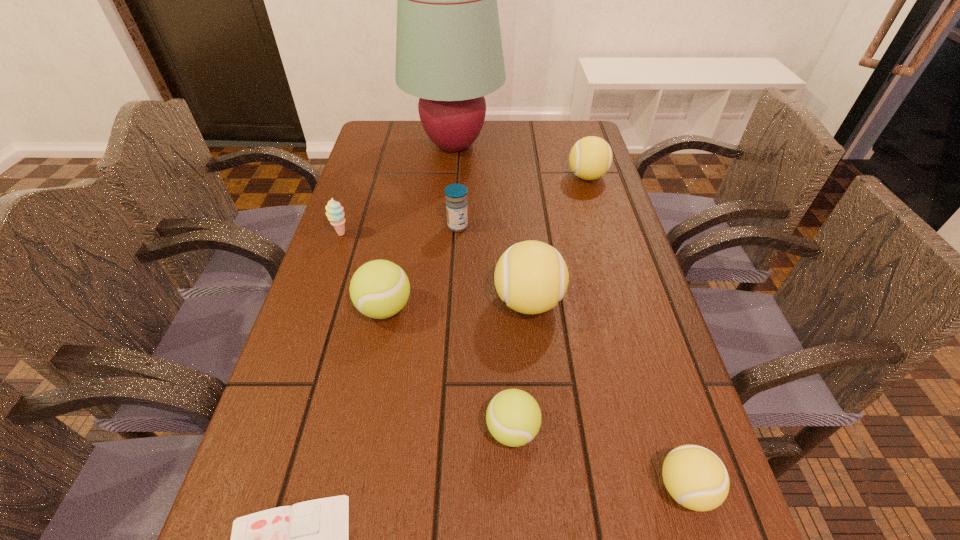
Select which yellow tennis ball is the second closest to the biggest yellow tennis ball. Please provide its 2D coordinates. Your answer should be formatted as a tuple, i.e. [(x, y)], where the tuple contains the x and y coordinates of a point satisfying the conditions above.

[(590, 158)]

Locate an element on the screen. The image size is (960, 540). the closest yellow tennis ball to the blue lampshade is located at coordinates (590, 158).

Identify the location of vacant area in the image that satisfies the following two spatial constraints: 1. on the back side of the bigger green tennis ball; 2. on the left side of the farthest yellow tennis ball. The image size is (960, 540). (410, 177).